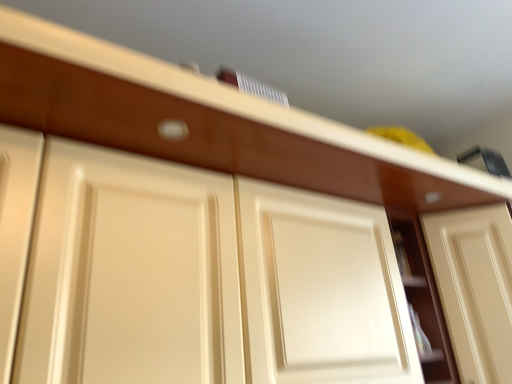
Question: Does matte cream door at center, acting as the 1th door starting from the right, have a larger size compared to matte cream drawer at center?

Choices:
 (A) no
 (B) yes

Answer: (B)

Question: Is matte cream door at center, acting as the 1th door starting from the right, not close to matte cream drawer at center?

Choices:
 (A) yes
 (B) no

Answer: (B)

Question: Is matte cream door at center, which is the second door from left to right, taller than matte cream drawer at center?

Choices:
 (A) yes
 (B) no

Answer: (A)

Question: From a real-world perspective, is matte cream door at center, acting as the 1th door starting from the right, over matte cream drawer at center?

Choices:
 (A) no
 (B) yes

Answer: (A)

Question: Is matte cream door at center, acting as the 1th door starting from the right, shorter than matte cream drawer at center?

Choices:
 (A) no
 (B) yes

Answer: (A)

Question: Is matte cream drawer at center located within matte cream door at center, which is the second door from left to right?

Choices:
 (A) yes
 (B) no

Answer: (B)

Question: Considering the relative sizes of matte cream cabinet at center and matte cream door at center, which is the second door from left to right, in the image provided, is matte cream cabinet at center bigger than matte cream door at center, which is the second door from left to right,?

Choices:
 (A) no
 (B) yes

Answer: (A)

Question: Does matte cream cabinet at center lie in front of matte cream door at center, acting as the 1th door starting from the right?

Choices:
 (A) no
 (B) yes

Answer: (A)

Question: From the image's perspective, is matte cream cabinet at center located beneath matte cream door at center, acting as the 1th door starting from the right?

Choices:
 (A) yes
 (B) no

Answer: (B)

Question: Is matte cream cabinet at center facing away from matte cream door at center, acting as the 1th door starting from the right?

Choices:
 (A) no
 (B) yes

Answer: (A)

Question: Does matte cream cabinet at center have a lesser width compared to matte cream door at center, acting as the 1th door starting from the right?

Choices:
 (A) no
 (B) yes

Answer: (B)

Question: Could you tell me if matte cream cabinet at center is turned towards matte cream door at center, acting as the 1th door starting from the right?

Choices:
 (A) no
 (B) yes

Answer: (A)

Question: From a real-world perspective, is matte cream drawer at center below matte cream cabinet at center?

Choices:
 (A) yes
 (B) no

Answer: (B)